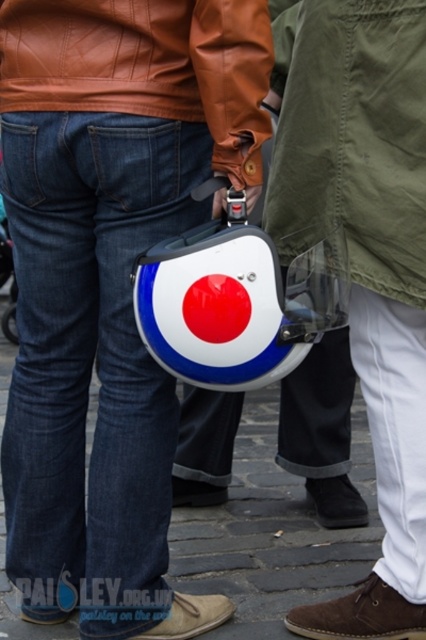
You are at a clothing store and see two jackets displayed on mannequins. The olive green canvas jacket at center and the brown leather jacket at upper center. Which one is positioned to the right of the other?

The olive green canvas jacket at center is positioned to the right of the brown leather jacket at upper center.

You are a delivery person who needs to hand over a package to the person in the image. The package must be placed on the ground between the white glossy helmet at center and the shiny plastic helmet at center. Is this possible?

The shiny plastic helmet at center is behind the white glossy helmet at center, so there is no space between them to place the package on the ground.